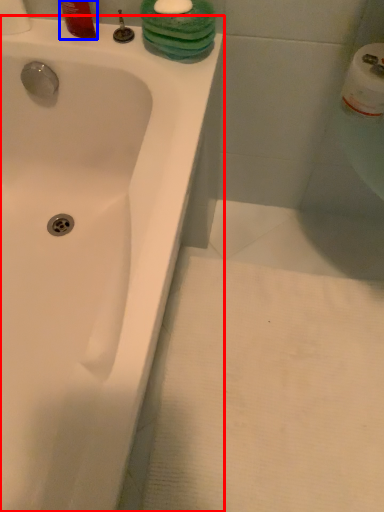
Question: Which object appears farthest to the camera in this image, bathtub (highlighted by a red box) or liquid (highlighted by a blue box)?

Choices:
 (A) bathtub
 (B) liquid

Answer: (B)